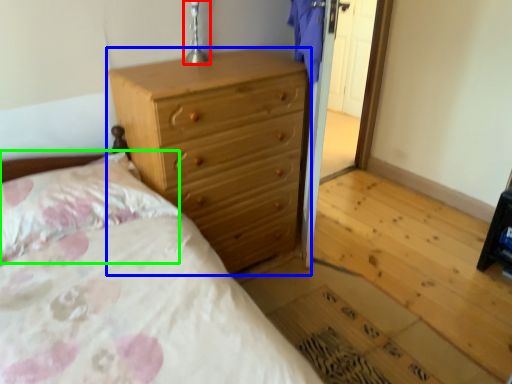
Question: Estimate the real-world distances between objects in this image. Which object is closer to table lamp (highlighted by a red box), chest of drawers (highlighted by a blue box) or pillow (highlighted by a green box)?

Choices:
 (A) chest of drawers
 (B) pillow

Answer: (A)